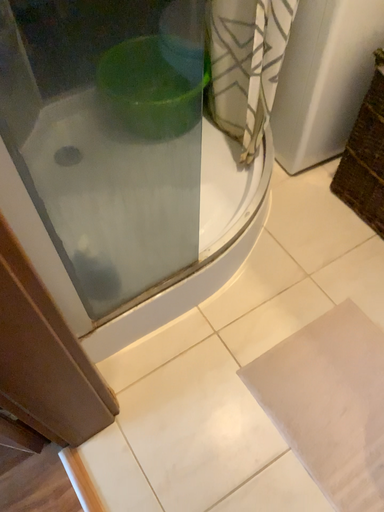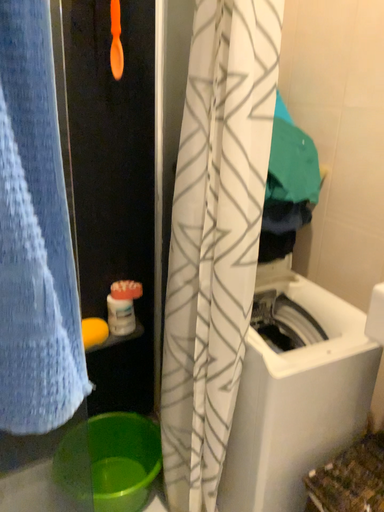
Question: Which way did the camera rotate in the video?

Choices:
 (A) rotated upward
 (B) rotated downward

Answer: (A)